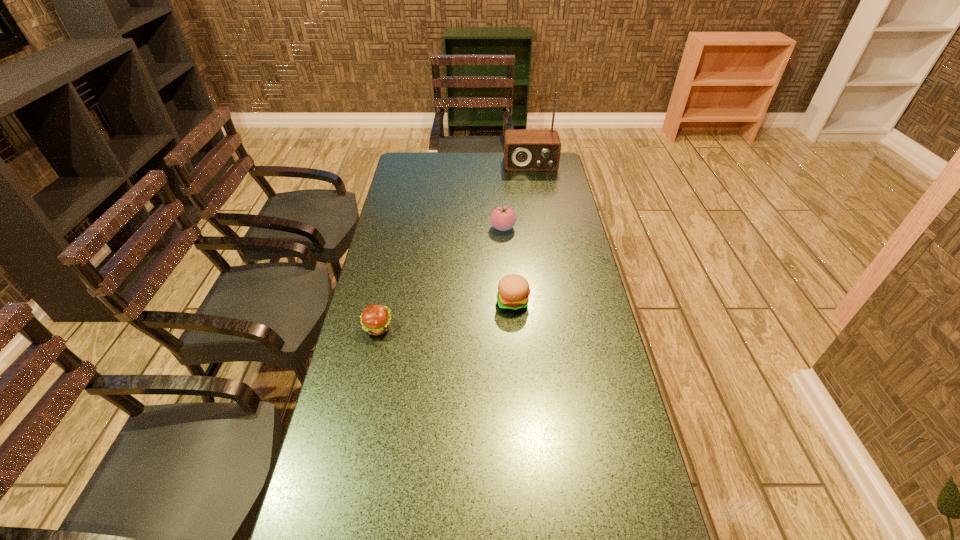
The image size is (960, 540). I want to click on the farthest object, so click(524, 150).

This screenshot has width=960, height=540. I want to click on radio receiver, so click(x=524, y=150).

This screenshot has width=960, height=540. Identify the location of the third farthest object. (513, 293).

What are the coordinates of `the farther hamburger` in the screenshot? It's located at (513, 293).

This screenshot has width=960, height=540. I want to click on the third nearest object, so click(502, 218).

Where is `the shortest object`? the shortest object is located at coordinates click(x=375, y=319).

Where is `the nearer hamburger`? the nearer hamburger is located at coordinates (375, 319).

The width and height of the screenshot is (960, 540). Identify the location of vacant space located 0.230m on the front-facing side of the tallest object. (537, 200).

At what (x,y) coordinates should I click in order to perform the action: click on free spot located on the back of the taller hamburger. Please return your answer as a coordinate pair (x, y). The height and width of the screenshot is (540, 960). Looking at the image, I should click on (510, 267).

Identify the location of vacant space positioned 0.280m on the back of the second farthest object. The height and width of the screenshot is (540, 960). (500, 183).